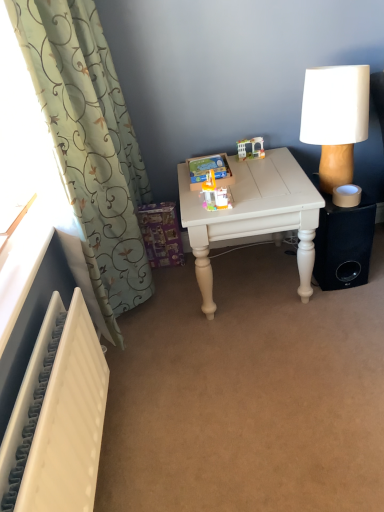
Find the location of a particular element. This screenshot has width=384, height=512. blank space to the left of black matte speaker at lower right is located at coordinates (275, 281).